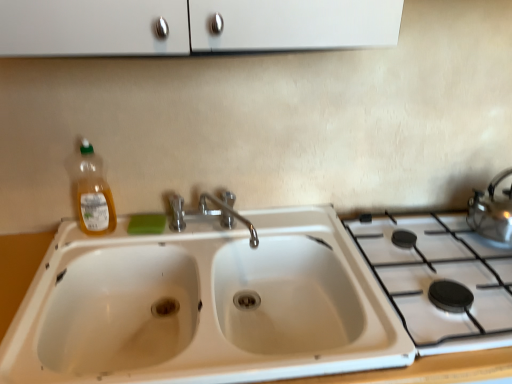
You are a GUI agent. You are given a task and a screenshot of the screen. Output one action in this format:
    pyautogui.click(x=<x>, y=<y>)
    Task: Click on the translucent plastic bottle at left
    This screenshot has width=512, height=384.
    Given the screenshot: What is the action you would take?
    pyautogui.click(x=93, y=195)

In the scene shown: In order to face green matte soap at center, should I rotate leftwards or rightwards?

You should rotate left by 13.986 degrees.

Find the location of a particular element. This screenshot has width=512, height=384. white ceramic gas stove at right is located at coordinates (440, 280).

The height and width of the screenshot is (384, 512). What are the coordinates of `translucent plastic bottle at left` in the screenshot? It's located at (93, 195).

Would you say satin silver kettle at right is part of green matte soap at center's contents?

No, green matte soap at center does not contain satin silver kettle at right.

Is green matte soap at center in contact with satin silver kettle at right?

green matte soap at center and satin silver kettle at right are clearly separated.

Does point (145, 225) appear closer or farther from the camera than point (509, 206)?

Point (145, 225) is farther from the camera than point (509, 206).

Which of these two, green matte soap at center or satin silver kettle at right, is wider?

Wider between the two is satin silver kettle at right.

This screenshot has height=384, width=512. What are the coordinates of `gas stove on the right of white ceramic sink at center` in the screenshot? It's located at (440, 280).

Is white ceramic sink at center outside of white ceramic gas stove at right?

Answer: Indeed, white ceramic sink at center is completely outside white ceramic gas stove at right.

Is white ceramic sink at center far from white ceramic gas stove at right?

No, there isn't a large distance between white ceramic sink at center and white ceramic gas stove at right.

Is chrome metallic faucet at center beside green matte soap at center?

There is a gap between chrome metallic faucet at center and green matte soap at center.

Considering the sizes of objects chrome metallic faucet at center and green matte soap at center in the image provided, who is smaller, chrome metallic faucet at center or green matte soap at center?

With smaller size is green matte soap at center.

From the image's perspective, is chrome metallic faucet at center above or below green matte soap at center?

From the image's perspective, chrome metallic faucet at center appears above green matte soap at center.

Considering the sizes of objects white ceramic gas stove at right and translucent plastic bottle at left in the image provided, who is wider, white ceramic gas stove at right or translucent plastic bottle at left?

white ceramic gas stove at right.

In terms of height, does white ceramic gas stove at right look taller or shorter compared to translucent plastic bottle at left?

Considering their sizes, white ceramic gas stove at right has less height than translucent plastic bottle at left.

Is white ceramic gas stove at right positioned with its back to translucent plastic bottle at left?

That's not correct — white ceramic gas stove at right is not looking away from translucent plastic bottle at left.

Which object is more forward, white ceramic gas stove at right or translucent plastic bottle at left?

Positioned in front is white ceramic gas stove at right.

Which object is further away from the camera, white ceramic sink at center or chrome metallic faucet at center?

Positioned behind is chrome metallic faucet at center.

Which is more to the right, white ceramic sink at center or chrome metallic faucet at center?

Positioned to the right is chrome metallic faucet at center.

Looking at this image, from the image's perspective, is white ceramic sink at center above or below chrome metallic faucet at center?

Clearly, from the image's perspective, white ceramic sink at center is below chrome metallic faucet at center.

Are white ceramic sink at center and chrome metallic faucet at center making contact?

They are not placed beside each other.

How distant is white ceramic gas stove at right from green matte soap at center?

white ceramic gas stove at right is 29.35 inches from green matte soap at center.

Does point (375, 254) come in front of point (137, 224)?

Yes, point (375, 254) is in front of point (137, 224).

I want to click on gas stove in front of the green matte soap at center, so click(x=440, y=280).

Could you tell me if white ceramic gas stove at right is turned towards green matte soap at center?

No.

From the image's perspective, would you say white ceramic sink at center is shown under green matte soap at center?

Yes, from the image's perspective, white ceramic sink at center is beneath green matte soap at center.

Does point (295, 353) come behind point (135, 222)?

That is False.

Would you say white ceramic sink at center is to the left or to the right of green matte soap at center in the picture?

Based on their positions, white ceramic sink at center is located to the right of green matte soap at center.

Based on the photo, considering the sizes of white ceramic sink at center and green matte soap at center in the image, is white ceramic sink at center wider or thinner than green matte soap at center?

Considering their sizes, white ceramic sink at center looks broader than green matte soap at center.

This screenshot has width=512, height=384. Identify the location of tea pot above the green matte soap at center (from a real-world perspective). (492, 211).

Image resolution: width=512 pixels, height=384 pixels. I want to click on gas stove behind the white ceramic sink at center, so click(440, 280).

Consider the image. When comparing their distances from translucent plastic bottle at left, does white ceramic gas stove at right or satin silver kettle at right seem closer?

Based on the image, white ceramic gas stove at right appears to be nearer to translucent plastic bottle at left.

Estimate the real-world distances between objects in this image. Which object is closer to chrome metallic faucet at center, white ceramic sink at center or white ceramic gas stove at right?

white ceramic sink at center lies closer to chrome metallic faucet at center than the other object.

From the image, which object appears to be nearer to translucent plastic bottle at left, green matte soap at center or satin silver kettle at right?

The object closer to translucent plastic bottle at left is green matte soap at center.

In the scene shown: Considering their positions, is chrome metallic faucet at center positioned further to white ceramic gas stove at right than translucent plastic bottle at left?

translucent plastic bottle at left lies further to white ceramic gas stove at right than the other object.

From the image, which object appears to be farther from chrome metallic faucet at center, white ceramic gas stove at right or satin silver kettle at right?

Based on the image, satin silver kettle at right appears to be further to chrome metallic faucet at center.

Considering their positions, is white ceramic gas stove at right positioned closer to satin silver kettle at right than chrome metallic faucet at center?

white ceramic gas stove at right.

Considering their positions, is white ceramic sink at center positioned closer to white ceramic gas stove at right than satin silver kettle at right?

satin silver kettle at right lies closer to white ceramic gas stove at right than the other object.

Estimate the real-world distances between objects in this image. Which object is further from green matte soap at center, white ceramic sink at center or satin silver kettle at right?

Based on the image, satin silver kettle at right appears to be further to green matte soap at center.

The image size is (512, 384). What are the coordinates of `tap between white ceramic sink at center and green matte soap at center in the front-back direction` in the screenshot? It's located at (232, 215).

The height and width of the screenshot is (384, 512). Identify the location of bottle between white ceramic sink at center and green matte soap at center from front to back. (93, 195).

Locate an element on the screen. Image resolution: width=512 pixels, height=384 pixels. tap between green matte soap at center and satin silver kettle at right from left to right is located at coordinates (232, 215).

Where is `tap between translucent plastic bottle at left and white ceramic gas stove at right`? This screenshot has width=512, height=384. tap between translucent plastic bottle at left and white ceramic gas stove at right is located at coordinates (232, 215).